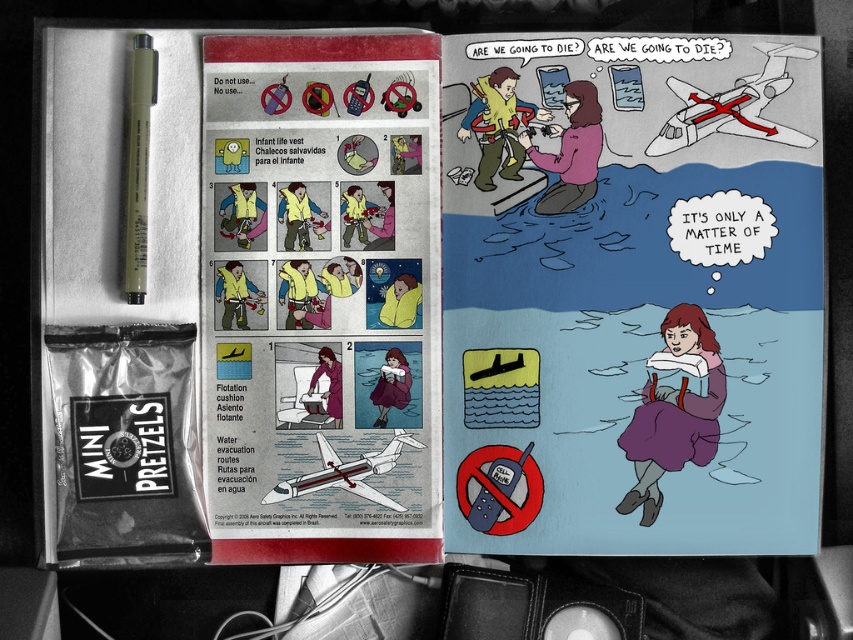
Question: Can you confirm if yellow paper at upper center is thinner than purple fabric dress at lower center?

Choices:
 (A) yes
 (B) no

Answer: (B)

Question: Based on their relative distances, which object is nearer to the purple fabric dress at lower center?

Choices:
 (A) olive matte pen at upper left
 (B) yellow paper at upper center

Answer: (B)

Question: Which point appears farthest from the camera in this image?

Choices:
 (A) (380, 332)
 (B) (131, 298)

Answer: (A)

Question: Is the position of yellow paper at upper center less distant than that of purple fabric dress at lower center?

Choices:
 (A) no
 (B) yes

Answer: (B)

Question: Among these points, which one is farthest from the camera?

Choices:
 (A) (x=650, y=445)
 (B) (x=432, y=362)

Answer: (B)

Question: Observing the image, what is the correct spatial positioning of purple fabric dress at lower center in reference to olive matte pen at upper left?

Choices:
 (A) right
 (B) left

Answer: (A)